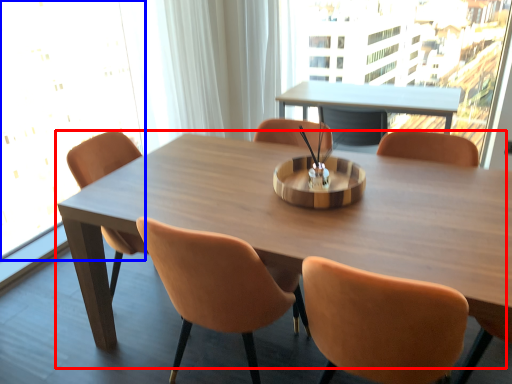
Question: Which object is further to the camera taking this photo, table (highlighted by a red box) or window screen (highlighted by a blue box)?

Choices:
 (A) table
 (B) window screen

Answer: (B)